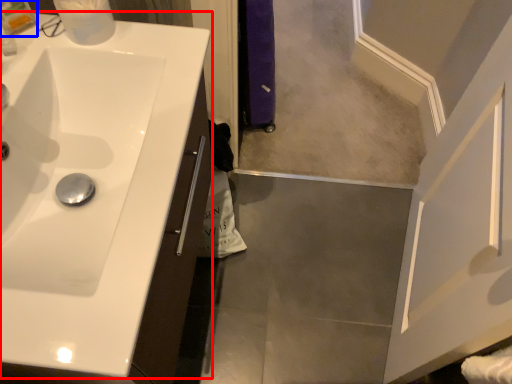
Question: Which point is closer to the camera, sink (highlighted by a red box) or toiletry (highlighted by a blue box)?

Choices:
 (A) sink
 (B) toiletry

Answer: (A)